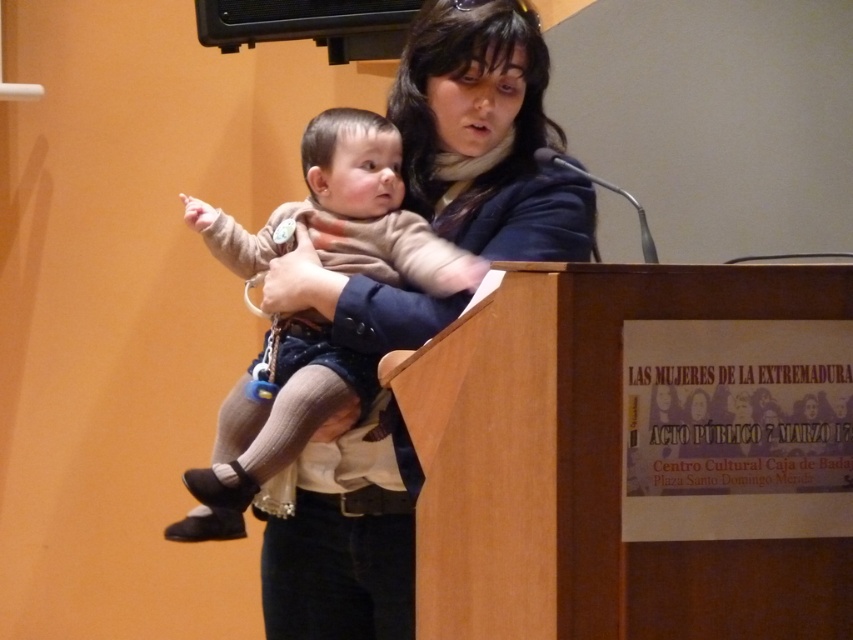
Question: Which of the following is the farthest from the observer?

Choices:
 (A) matte black jacket at center
 (B) light brown knit sweater at center

Answer: (B)

Question: Does matte black jacket at center have a larger size compared to light brown knit sweater at center?

Choices:
 (A) no
 (B) yes

Answer: (B)

Question: Does matte black jacket at center appear under light brown knit sweater at center?

Choices:
 (A) no
 (B) yes

Answer: (B)

Question: Is matte black jacket at center to the left of light brown knit sweater at center from the viewer's perspective?

Choices:
 (A) yes
 (B) no

Answer: (B)